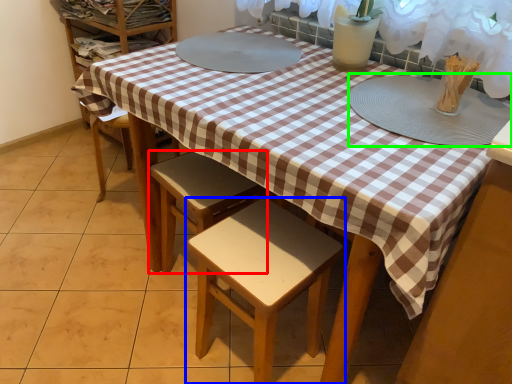
Question: Estimate the real-world distances between objects in this image. Which object is farther from stool (highlighted by a red box), stool (highlighted by a blue box) or platter (highlighted by a green box)?

Choices:
 (A) stool
 (B) platter

Answer: (B)